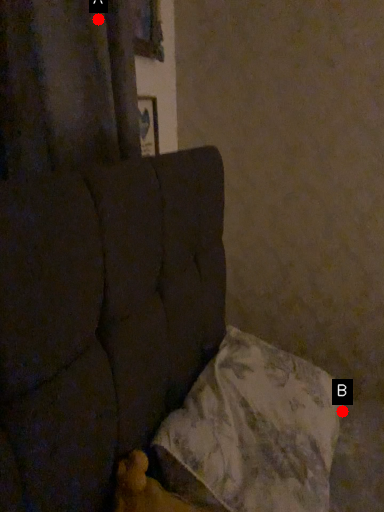
Question: Two points are circled on the image, labeled by A and B beside each circle. Which point appears closest to the camera in this image?

Choices:
 (A) A is closer
 (B) B is closer

Answer: (A)